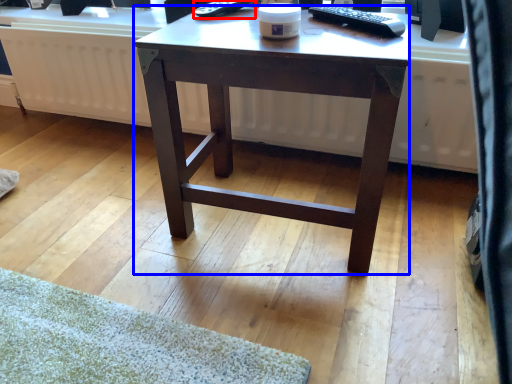
Question: Which of the following is the farthest to the observer, remote control (highlighted by a red box) or desk (highlighted by a blue box)?

Choices:
 (A) remote control
 (B) desk

Answer: (A)